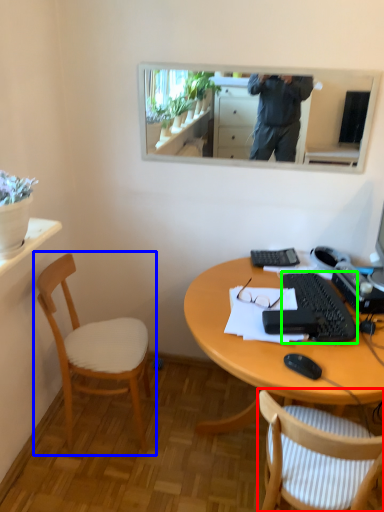
Question: Which object is the farthest from chair (highlighted by a red box)? Choose among these: chair (highlighted by a blue box) or keyboard (highlighted by a green box).

Choices:
 (A) chair
 (B) keyboard

Answer: (A)